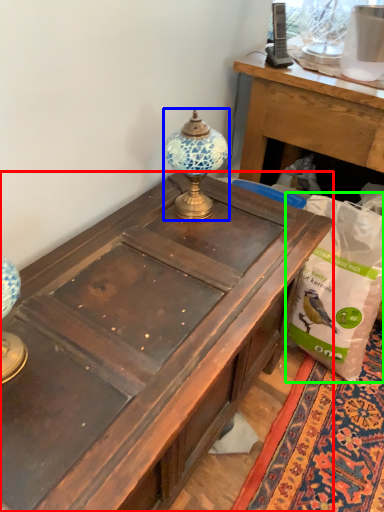
Question: Considering the real-world distances, which object is farthest from desk (highlighted by a red box)? lamp (highlighted by a blue box) or paper bag (highlighted by a green box)?

Choices:
 (A) lamp
 (B) paper bag

Answer: (B)